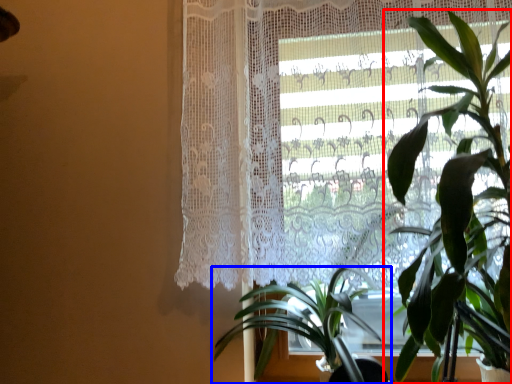
Question: Which of the following is the closest to the observer, houseplant (highlighted by a red box) or houseplant (highlighted by a blue box)?

Choices:
 (A) houseplant
 (B) houseplant

Answer: (A)